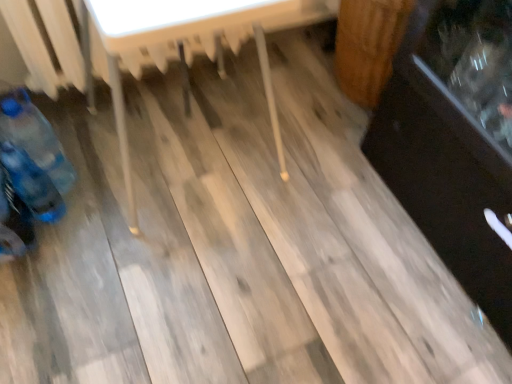
Question: In terms of height, does blue plastic bottle at left, marked as the 2th bottle in a bottom-to-top arrangement, look taller or shorter compared to wooden table at center?

Choices:
 (A) tall
 (B) short

Answer: (B)

Question: From the image's perspective, relative to wooden table at center, is blue plastic bottle at left, marked as the 2th bottle in a bottom-to-top arrangement, above or below?

Choices:
 (A) above
 (B) below

Answer: (B)

Question: Estimate the real-world distances between objects in this image. Which object is closer to the wooden table at center?

Choices:
 (A) blue plastic bottle at left, marked as the 2th bottle in a bottom-to-top arrangement
 (B) blue plastic bottle at lower left, the first bottle in the bottom-to-top sequence

Answer: (A)

Question: Estimate the real-world distances between objects in this image. Which object is farther from the blue plastic bottle at left, arranged as the 1th bottle when viewed from the top?

Choices:
 (A) blue plastic bottle at lower left, the first bottle in the bottom-to-top sequence
 (B) wooden table at center

Answer: (B)